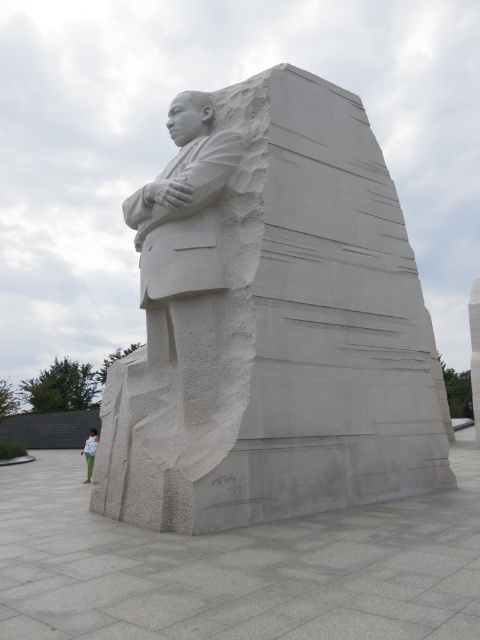
Question: Is white stone statue at center to the right of green fabric pants at lower left from the viewer's perspective?

Choices:
 (A) yes
 (B) no

Answer: (A)

Question: Is white stone statue at center to the right of green fabric pants at lower left from the viewer's perspective?

Choices:
 (A) yes
 (B) no

Answer: (A)

Question: Among these points, which one is farthest from the camera?

Choices:
 (A) click(x=91, y=436)
 (B) click(x=372, y=408)

Answer: (A)

Question: Which point is closer to the camera?

Choices:
 (A) (85, 444)
 (B) (193, 100)

Answer: (B)

Question: Does white stone statue at center appear on the left side of green fabric pants at lower left?

Choices:
 (A) no
 (B) yes

Answer: (A)